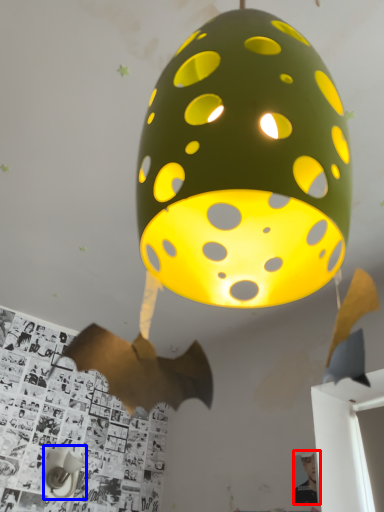
Question: Which of the following is the farthest to the observer, person (highlighted by a red box) or table lamp (highlighted by a blue box)?

Choices:
 (A) person
 (B) table lamp

Answer: (B)